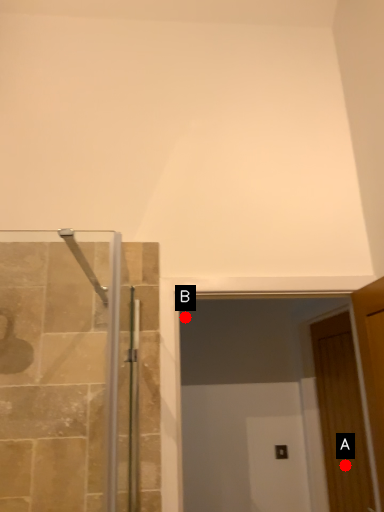
Question: Two points are circled on the image, labeled by A and B beside each circle. Which point is closer to the camera?

Choices:
 (A) A is closer
 (B) B is closer

Answer: (A)